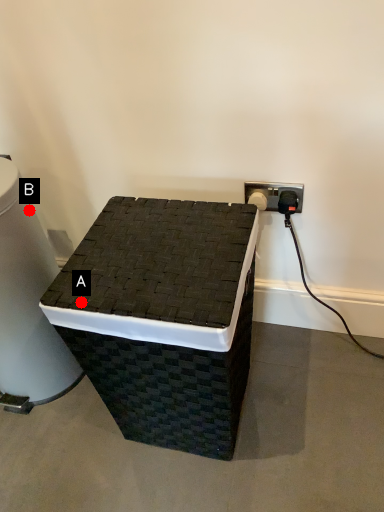
Question: Two points are circled on the image, labeled by A and B beside each circle. Which of the following is the closest to the observer?

Choices:
 (A) A is closer
 (B) B is closer

Answer: (A)